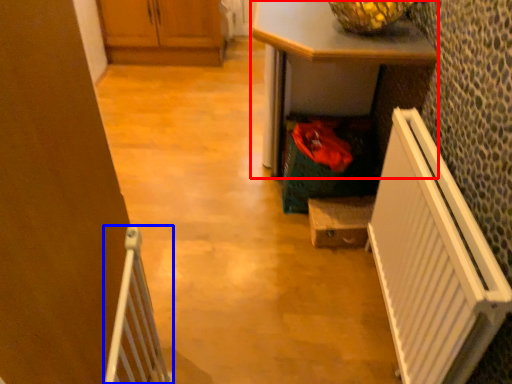
Question: Which object is further to the camera taking this photo, desk (highlighted by a red box) or radiator (highlighted by a blue box)?

Choices:
 (A) desk
 (B) radiator

Answer: (A)